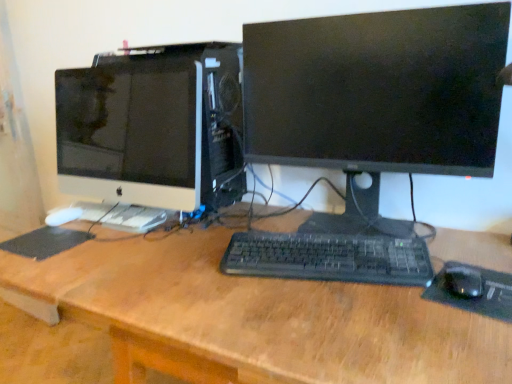
Question: Can you confirm if black rubber mousepad at lower right, which is the first mousepad from right to left, is positioned to the right of black matte mousepad at lower left, which appears as the second mousepad when viewed from the front?

Choices:
 (A) no
 (B) yes

Answer: (B)

Question: Would you consider black rubber mousepad at lower right, the 2th mousepad in the left-to-right sequence, to be distant from black matte mousepad at lower left, marked as the first mousepad in a left-to-right arrangement?

Choices:
 (A) yes
 (B) no

Answer: (B)

Question: Does black rubber mousepad at lower right, which is the first mousepad from right to left, appear on the left side of black matte mousepad at lower left, marked as the first mousepad in a left-to-right arrangement?

Choices:
 (A) no
 (B) yes

Answer: (A)

Question: Is black matte mousepad at lower left, which is the 2th mousepad in right-to-left order, a part of black rubber mousepad at lower right, the 1th mousepad positioned from the front?

Choices:
 (A) yes
 (B) no

Answer: (B)

Question: Can you confirm if black rubber mousepad at lower right, which is the first mousepad from right to left, is shorter than black matte mousepad at lower left, which appears as the second mousepad when viewed from the front?

Choices:
 (A) no
 (B) yes

Answer: (A)

Question: From a real-world perspective, is black rubber mousepad at lower right, which ranks as the 2th mousepad in back-to-front order, below black matte mousepad at lower left, which appears as the second mousepad when viewed from the front?

Choices:
 (A) yes
 (B) no

Answer: (A)

Question: Is black matte mousepad at lower left, the 1th mousepad from the back, with white glossy computer monitor at left, the 2th computer monitor positioned from the right?

Choices:
 (A) no
 (B) yes

Answer: (A)

Question: Does black matte mousepad at lower left, which is the 2th mousepad in right-to-left order, have a greater width compared to white glossy computer monitor at left, positioned as the 1th computer monitor in left-to-right order?

Choices:
 (A) no
 (B) yes

Answer: (A)

Question: Is black matte mousepad at lower left, the 1th mousepad from the back, in front of white glossy computer monitor at left, positioned as the 1th computer monitor in left-to-right order?

Choices:
 (A) no
 (B) yes

Answer: (B)

Question: Is black matte mousepad at lower left, which appears as the second mousepad when viewed from the front, smaller than white glossy computer monitor at left, positioned as the 1th computer monitor in left-to-right order?

Choices:
 (A) no
 (B) yes

Answer: (B)

Question: From a real-world perspective, is black matte mousepad at lower left, which appears as the second mousepad when viewed from the front, physically above white glossy computer monitor at left, the 2th computer monitor positioned from the right?

Choices:
 (A) no
 (B) yes

Answer: (A)

Question: Is black matte mousepad at lower left, marked as the first mousepad in a left-to-right arrangement, at the right side of white glossy computer monitor at left, the 2th computer monitor positioned from the right?

Choices:
 (A) yes
 (B) no

Answer: (B)

Question: Is black plastic keyboard at center positioned with its back to white glossy computer monitor at left, positioned as the 1th computer monitor in left-to-right order?

Choices:
 (A) yes
 (B) no

Answer: (B)